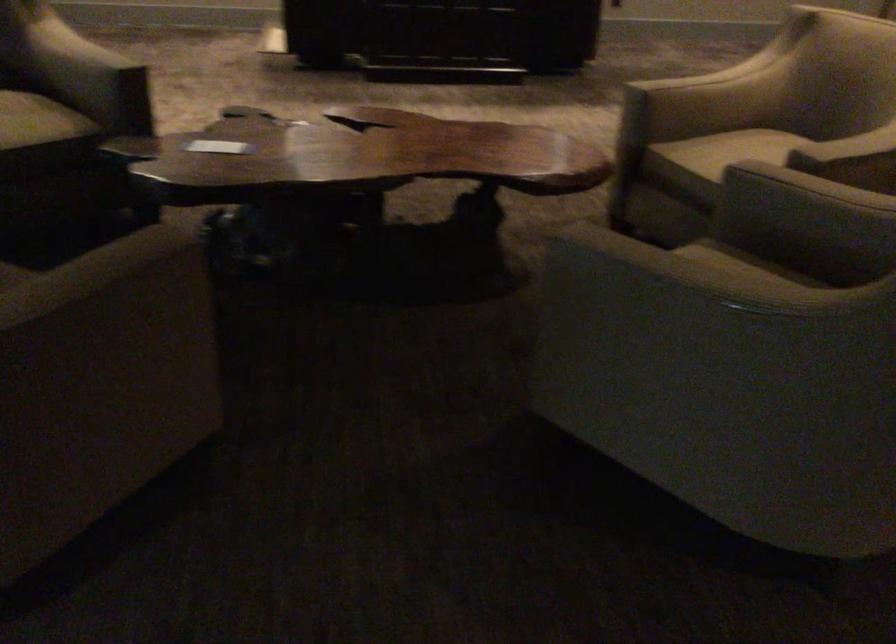
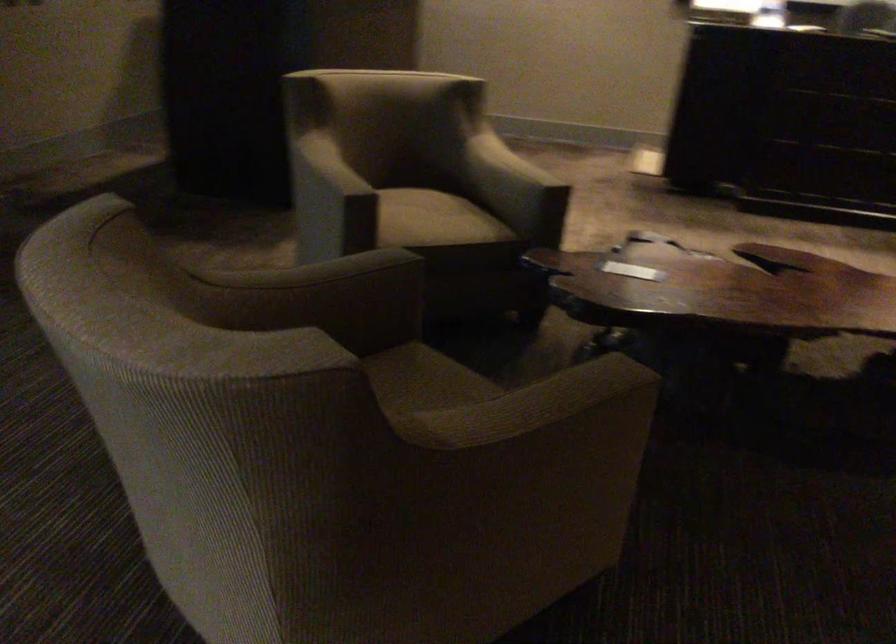
Question: How did the camera likely rotate?

Choices:
 (A) Left
 (B) Right
 (C) Up
 (D) Down

Answer: (A)